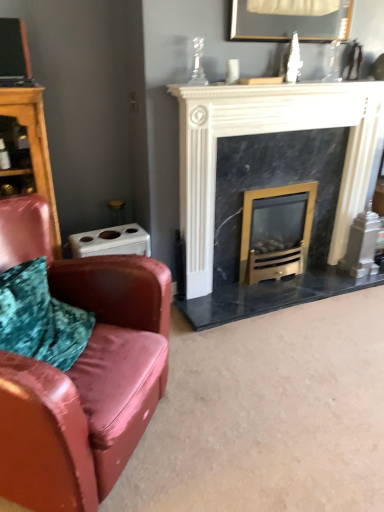
Question: Considering the positions of point [x=203, y=121] and point [x=309, y=227], is point [x=203, y=121] closer or farther from the camera than point [x=309, y=227]?

Choices:
 (A) farther
 (B) closer

Answer: (B)

Question: Based on their sizes in the image, would you say black marble fireplace at center is bigger or smaller than gold metallic wood burning stove at center?

Choices:
 (A) big
 (B) small

Answer: (A)

Question: Estimate the real-world distances between objects in this image. Which object is closer to the gold metallic wood burning stove at center?

Choices:
 (A) black marble fireplace at center
 (B) wooden dresser at left
 (C) leather couch at left

Answer: (A)

Question: Which object is positioned closest to the leather couch at left?

Choices:
 (A) wooden dresser at left
 (B) gold metallic wood burning stove at center
 (C) black marble fireplace at center

Answer: (A)